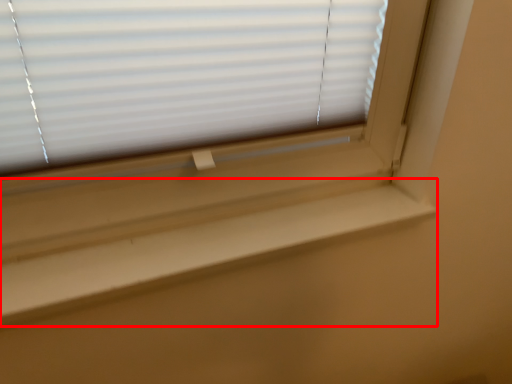
Question: From the image's perspective, considering the relative positions of window sill (annotated by the red box) and window blind in the image provided, where is window sill (annotated by the red box) located with respect to the staircase?

Choices:
 (A) below
 (B) above

Answer: (A)